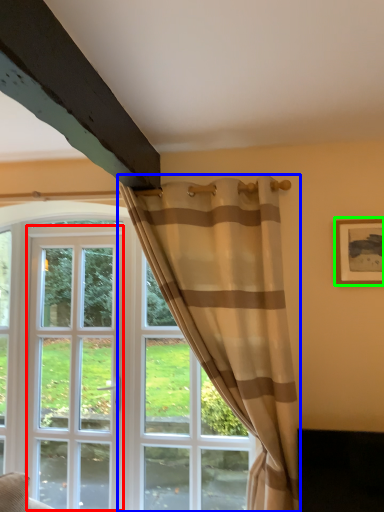
Question: Which is nearer to the screen door (highlighted by a red box)? curtain (highlighted by a blue box) or picture frame (highlighted by a green box).

Choices:
 (A) curtain
 (B) picture frame

Answer: (A)